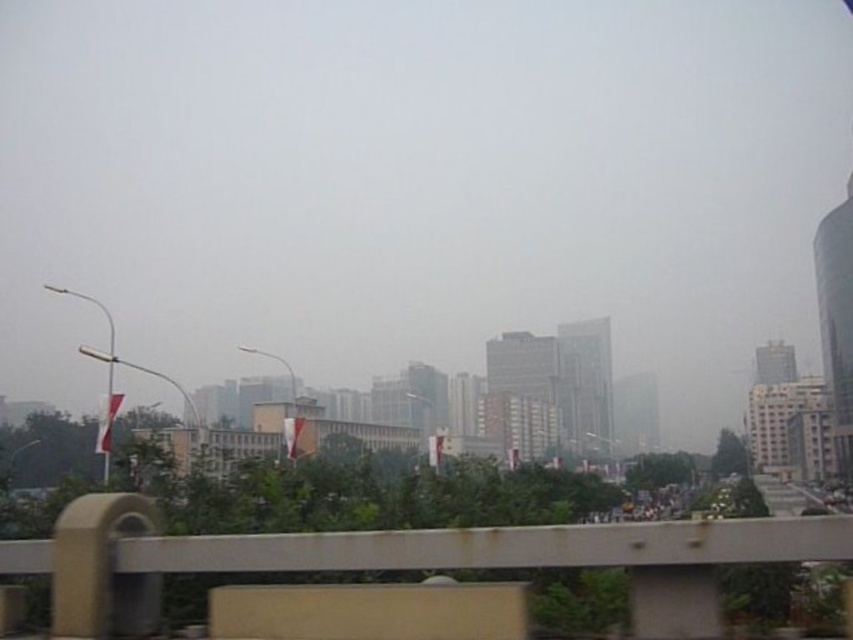
In the scene shown: You are standing in the urban scene and want to move from the point at coordinates point (715, 563) to the point at coordinates point (100, 438). Since you can only move forward, will you be moving towards or away from the viewer as you go from the first point to the second?

Point (715, 563) is closer to the viewer than point (100, 438). Therefore, moving from the first point to the second would mean moving away from the viewer.